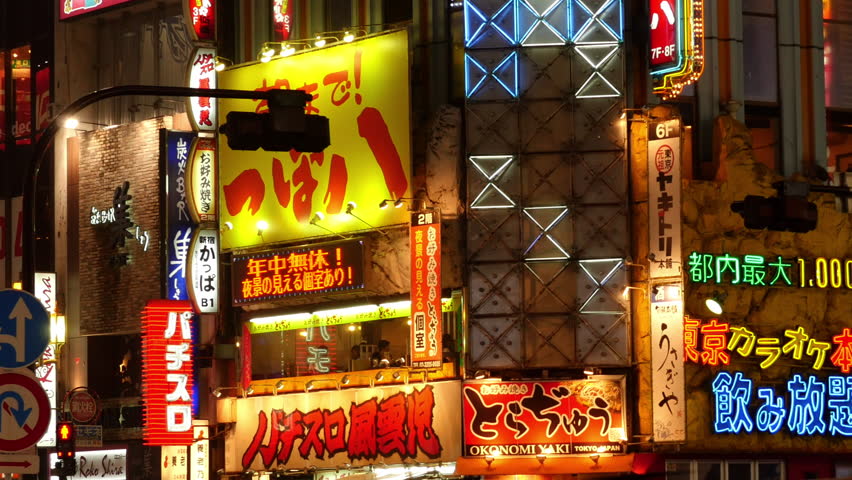
This screenshot has width=852, height=480. Identify the location of green neon light chinese character. (694, 268), (704, 270), (726, 269), (757, 276), (781, 267).